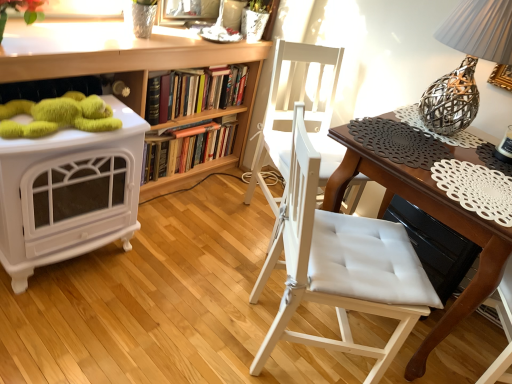
Question: Considering the relative positions of wooden bookcase at upper center and white padded chair at center, acting as the 1th chair starting from the back, in the image provided, is wooden bookcase at upper center behind white padded chair at center, acting as the 1th chair starting from the back,?

Choices:
 (A) no
 (B) yes

Answer: (B)

Question: Can you confirm if wooden bookcase at upper center is positioned to the left of white padded chair at center, the 2th chair positioned from the front?

Choices:
 (A) no
 (B) yes

Answer: (B)

Question: From the image's perspective, is wooden bookcase at upper center over white padded chair at center, the 2th chair positioned from the front?

Choices:
 (A) no
 (B) yes

Answer: (B)

Question: Is white padded chair at center, acting as the 1th chair starting from the back, a part of wooden bookcase at upper center?

Choices:
 (A) yes
 (B) no

Answer: (B)

Question: Does wooden bookcase at upper center turn towards white padded chair at center, the 2th chair positioned from the front?

Choices:
 (A) yes
 (B) no

Answer: (A)

Question: Would you say wooden bookcase at upper center is outside white padded chair at center, acting as the 1th chair starting from the back?

Choices:
 (A) no
 (B) yes

Answer: (B)

Question: From a real-world perspective, does woven metallic lampshade at upper right sit lower than hardcover books at center, arranged as the first book when viewed from the top?

Choices:
 (A) yes
 (B) no

Answer: (B)

Question: Would you say hardcover books at center, the 2th book ordered from the bottom, is part of woven metallic lampshade at upper right's contents?

Choices:
 (A) yes
 (B) no

Answer: (B)

Question: Does woven metallic lampshade at upper right appear on the left side of hardcover books at center, arranged as the first book when viewed from the top?

Choices:
 (A) yes
 (B) no

Answer: (B)

Question: Is hardcover books at center, arranged as the first book when viewed from the top, at the back of woven metallic lampshade at upper right?

Choices:
 (A) yes
 (B) no

Answer: (B)

Question: Is woven metallic lampshade at upper right directly adjacent to hardcover books at center, arranged as the first book when viewed from the top?

Choices:
 (A) yes
 (B) no

Answer: (B)

Question: Considering the relative sizes of woven metallic lampshade at upper right and hardcover books at center, the 2th book ordered from the bottom, in the image provided, is woven metallic lampshade at upper right taller than hardcover books at center, the 2th book ordered from the bottom,?

Choices:
 (A) yes
 (B) no

Answer: (A)

Question: Is white padded chair at center, the 2th chair positioned from the front, not near hardcover book at center, which is counted as the second book, starting from the top?

Choices:
 (A) yes
 (B) no

Answer: (B)